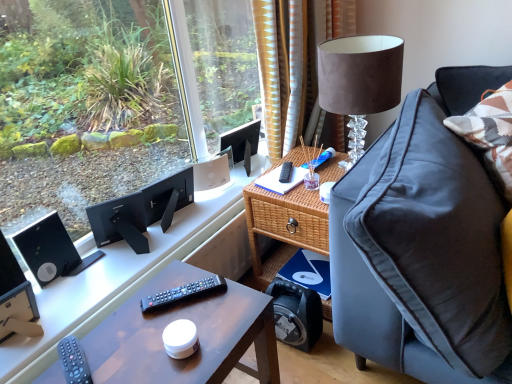
Question: From their relative heights in the image, would you say black plastic speaker at lower left, which is counted as the first loudspeaker, starting from the front, is taller or shorter than white matte speaker at upper center?

Choices:
 (A) tall
 (B) short

Answer: (A)

Question: Is point (2, 269) closer or farther from the camera than point (224, 175)?

Choices:
 (A) closer
 (B) farther

Answer: (A)

Question: Which object is positioned farthest from the black plastic speaker at lower left, which is counted as the first loudspeaker, starting from the front?

Choices:
 (A) black matte computer desk at left
 (B) black plastic remote control at upper right, the 1th remote control in the right-to-left sequence
 (C) suede lampshade at upper right
 (D) woven wood side table at center
 (E) white matte speaker at upper center

Answer: (C)

Question: Which of these objects is positioned closest to the black plastic speaker at upper left, which appears as the first loudspeaker when viewed from the back?

Choices:
 (A) suede lampshade at upper right
 (B) black matte computer desk at left
 (C) black plastic remote control at upper right, which appears as the 1th remote control when viewed from the top
 (D) black plastic remote at center, marked as the 2th remote control in a back-to-front arrangement
 (E) matte black desk at center

Answer: (B)